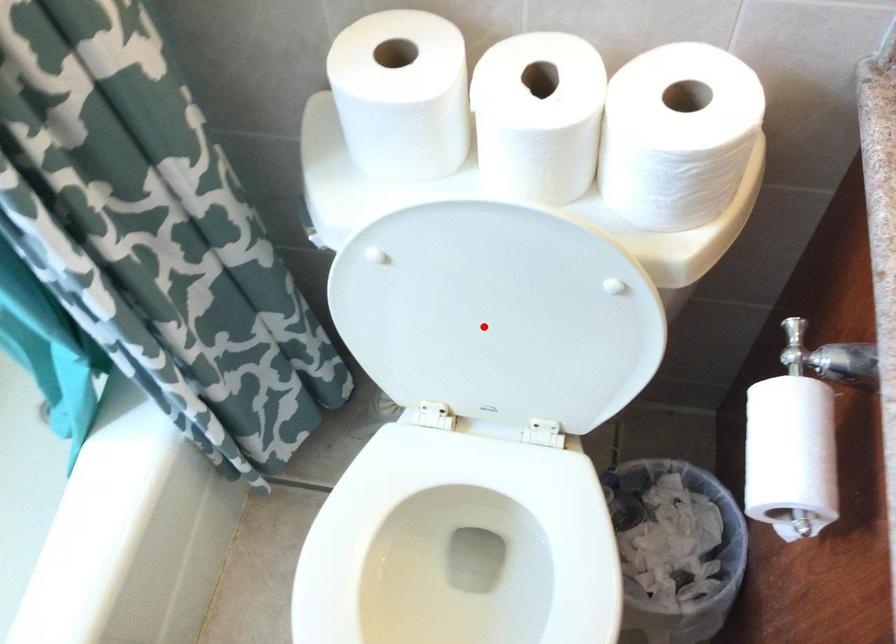
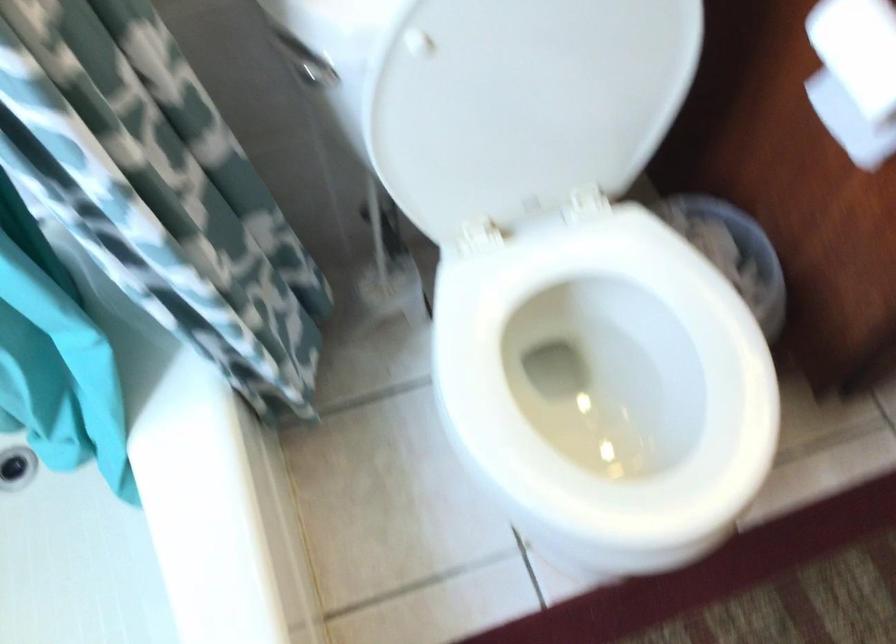
Locate, in the second image, the point that corresponds to the highlighted location in the first image.

(528, 93)